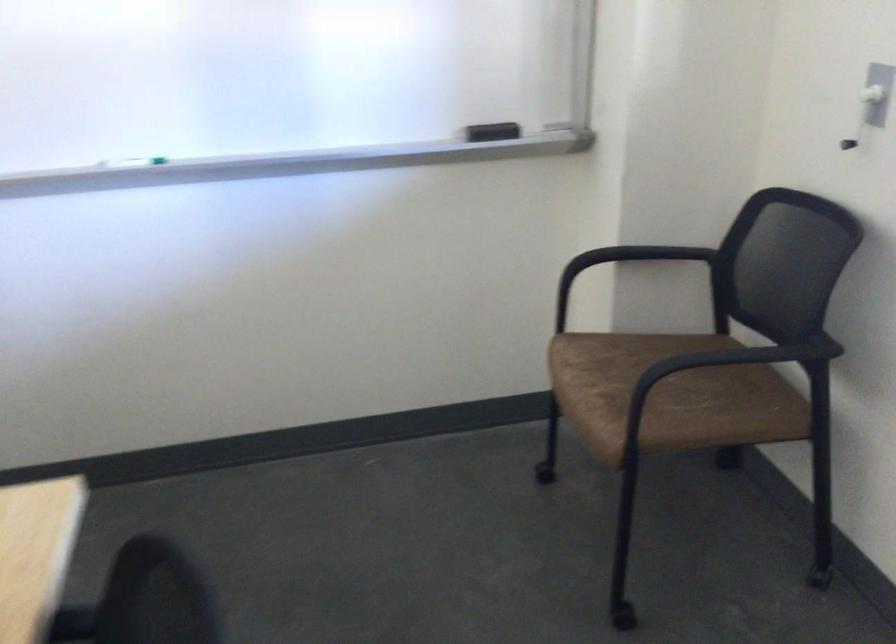
I want to click on brown chair sitting surface, so click(669, 395).